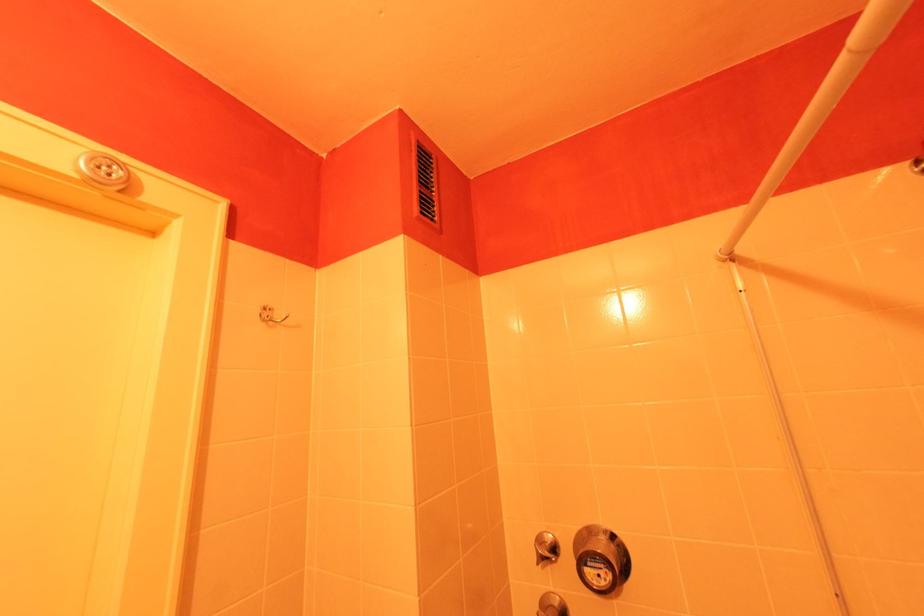
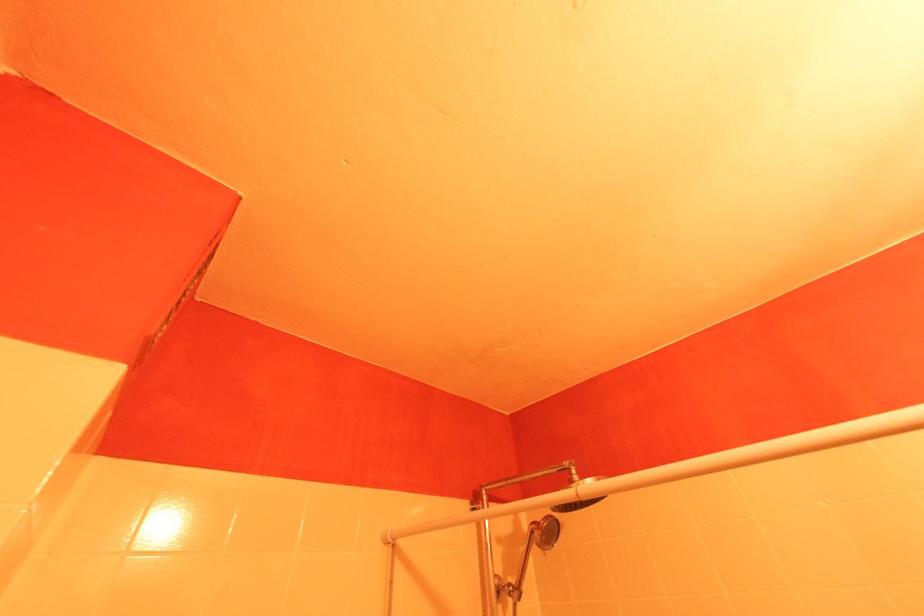
The images are taken continuously from a first-person perspective. In which direction is your viewpoint rotating?

The camera's rotation is toward right-up.